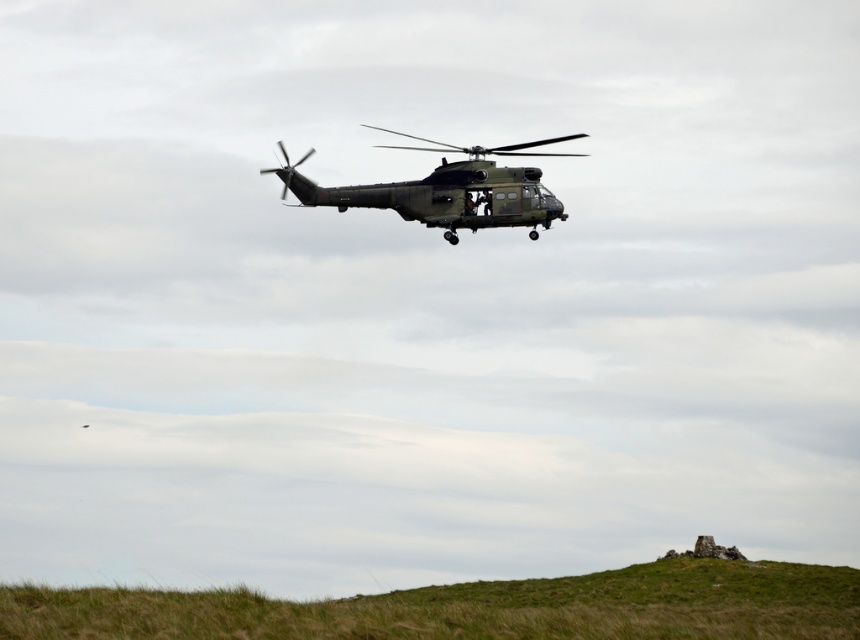
You are a drone operator trying to land your drone on the green grassy hill at lower center. However, there is a matte green helicopter at center in the way. Based on their positions, can you safely land your drone on the hill without interfering with the helicopter?

The green grassy hill at lower center is closer to the viewer than the matte green helicopter at center, so the drone can safely land on the hill as it is positioned in front of the helicopter and not in its flight path.

You are a drone operator trying to land a small drone on the green grassy hill at lower center. The coordinates for the landing zone are given as point (473, 608). Can you confirm if this point corresponds to the green grassy hill at lower center?

Yes, the green grassy hill at lower center is represented by point (473, 608), so the coordinates provided correspond to the correct landing zone on the green grassy hill at lower center.